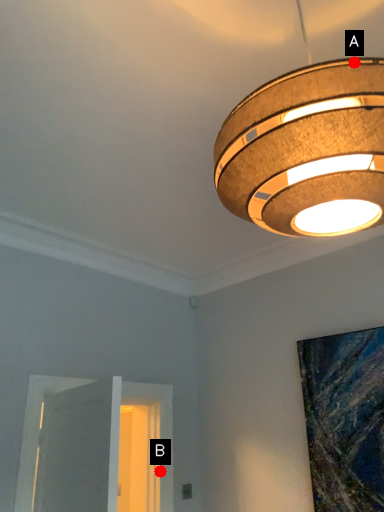
Question: Two points are circled on the image, labeled by A and B beside each circle. Which point is closer to the camera?

Choices:
 (A) A is closer
 (B) B is closer

Answer: (A)